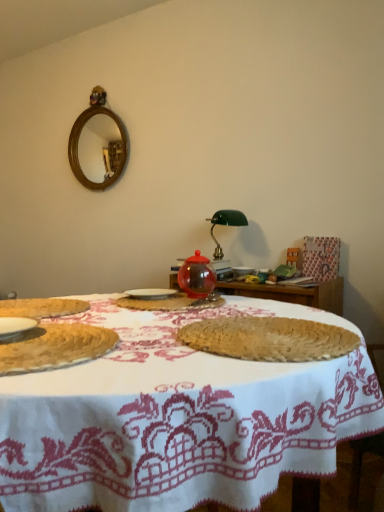
Question: Is green glass table lamp at center to the right of white woven placemat at center from the viewer's perspective?

Choices:
 (A) yes
 (B) no

Answer: (A)

Question: From the image's perspective, would you say green glass table lamp at center is positioned over white woven placemat at center?

Choices:
 (A) yes
 (B) no

Answer: (A)

Question: From a real-world perspective, is green glass table lamp at center on top of white woven placemat at center?

Choices:
 (A) yes
 (B) no

Answer: (A)

Question: Considering the relative sizes of green glass table lamp at center and white woven placemat at center in the image provided, is green glass table lamp at center shorter than white woven placemat at center?

Choices:
 (A) no
 (B) yes

Answer: (A)

Question: Is green glass table lamp at center not within white woven placemat at center?

Choices:
 (A) yes
 (B) no

Answer: (A)

Question: Does green glass table lamp at center have a lesser width compared to white woven placemat at center?

Choices:
 (A) yes
 (B) no

Answer: (A)

Question: Does white ceramic plate at center have a lesser width compared to braided straw placemat at center, the second food positioned from the back?

Choices:
 (A) no
 (B) yes

Answer: (B)

Question: Could you tell me if white ceramic plate at center is facing braided straw placemat at center, arranged as the second food when viewed from the front?

Choices:
 (A) no
 (B) yes

Answer: (A)

Question: Is white ceramic plate at center shorter than braided straw placemat at center, arranged as the second food when viewed from the front?

Choices:
 (A) no
 (B) yes

Answer: (A)

Question: From the image's perspective, is white ceramic plate at center above braided straw placemat at center, arranged as the second food when viewed from the front?

Choices:
 (A) no
 (B) yes

Answer: (B)

Question: Would you say white ceramic plate at center contains braided straw placemat at center, the second food positioned from the back?

Choices:
 (A) no
 (B) yes

Answer: (A)

Question: Is white ceramic plate at center touching braided straw placemat at center, arranged as the second food when viewed from the front?

Choices:
 (A) yes
 (B) no

Answer: (B)

Question: From a real-world perspective, is white ceramic plate at center on transparent glass jar at center, which is the 3th food in front-to-back order?

Choices:
 (A) yes
 (B) no

Answer: (A)